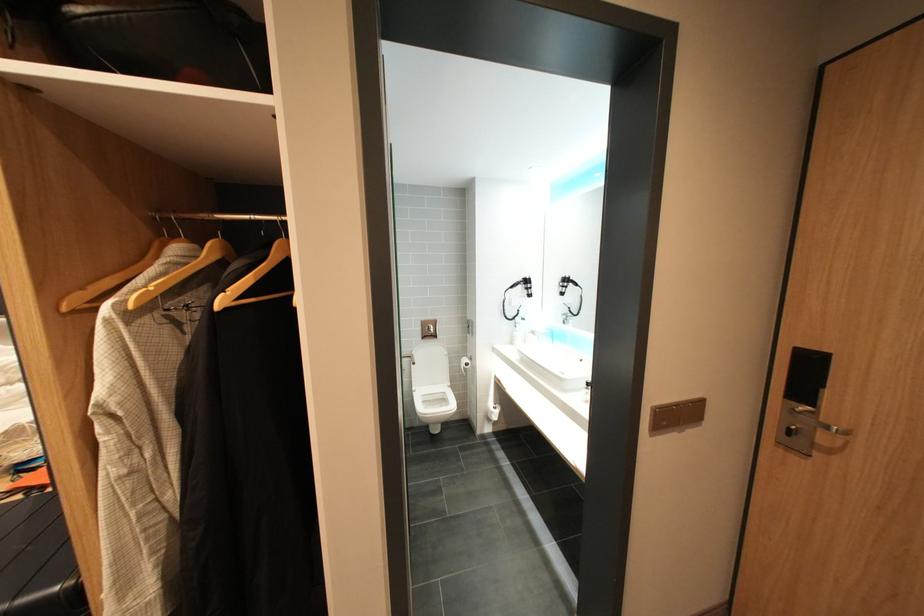
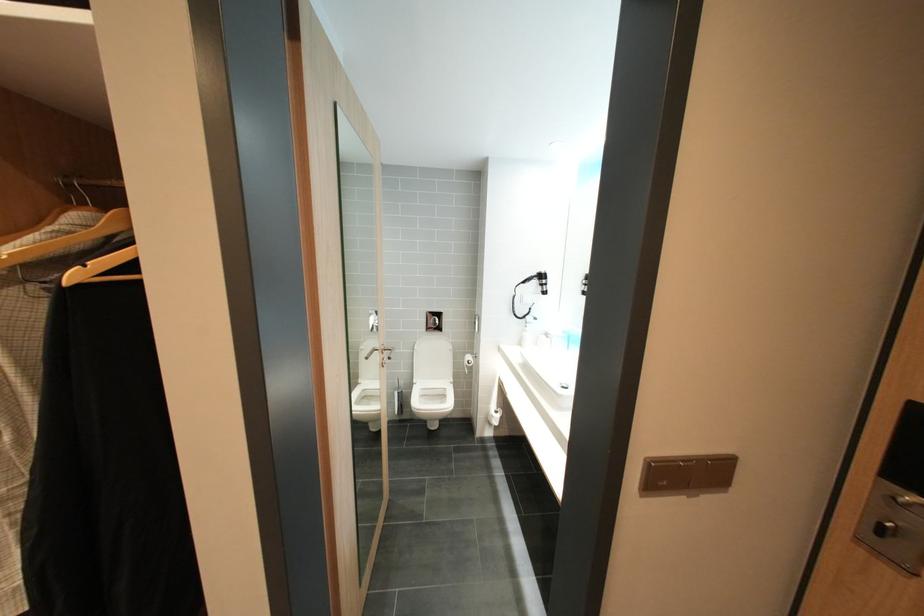
Where in the second image is the point corresponding to pixel 192 262 from the first image?

(91, 231)